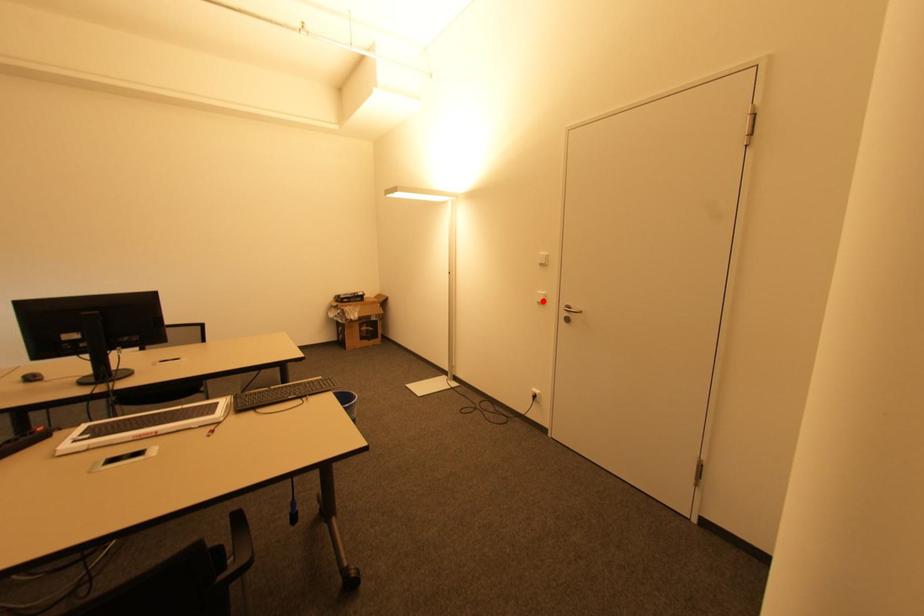
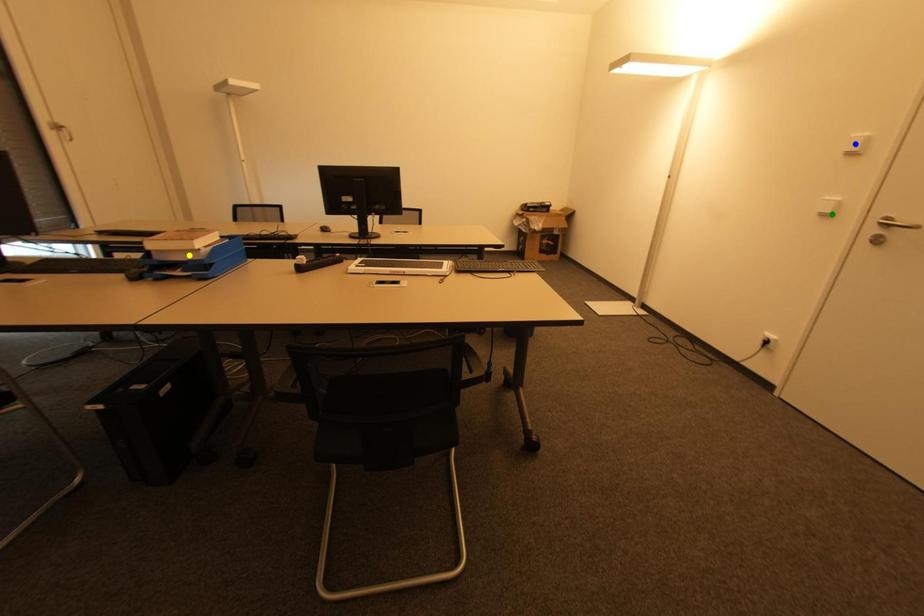
Question: I am providing you with two images of the same scene from different viewpoints. A red point is marked on the first image. You are given multiple points on the second image. Can you choose the point in image 2 that corresponds to the point in image 1?

Choices:
 (A) blue point
 (B) yellow point
 (C) green point

Answer: (C)